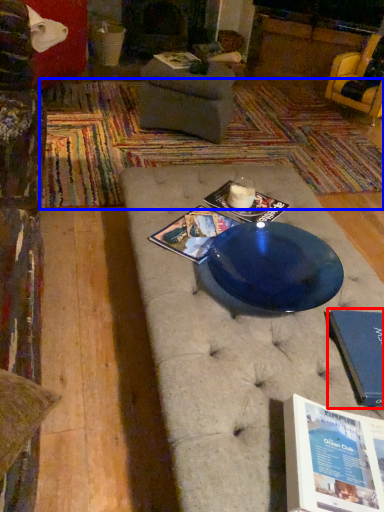
Question: Which object appears farthest to the camera in this image, paperback book (highlighted by a red box) or mat (highlighted by a blue box)?

Choices:
 (A) paperback book
 (B) mat

Answer: (B)